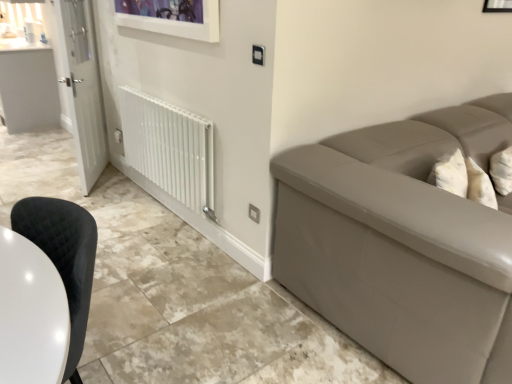
The height and width of the screenshot is (384, 512). I want to click on vacant area located to the right-hand side of white glossy door at left, so click(x=115, y=183).